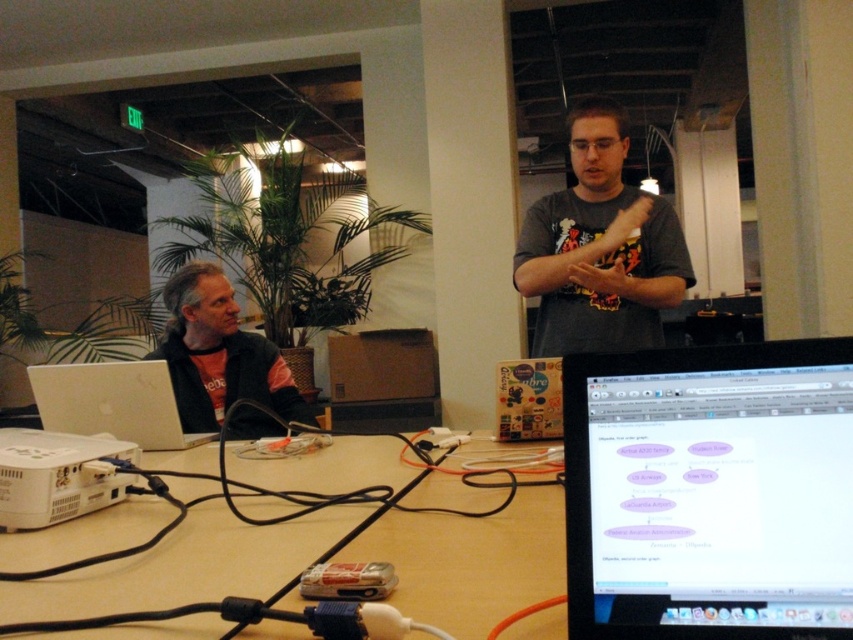
You are standing in the workshop and see two points marked on the floor. The first point is at coordinate point[140,524] and the second is at point[527,278]. If you want to move from the first point to the second point, will you have to walk past the projector located on the table?

The point[140,524] is in front of point[527,278], so moving from the first point to the second would require walking past the projector on the table since the first point is closer to you than the second point.